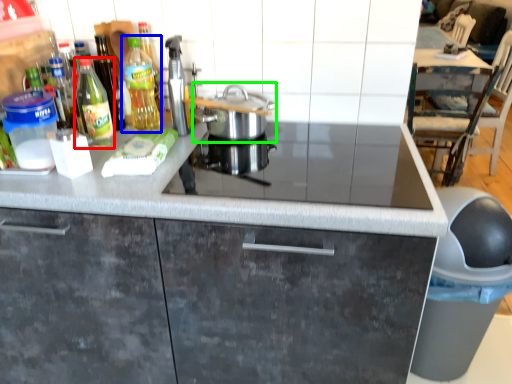
Question: Which object is positioned farthest from kitchen appliance (highlighted by a red box)? Select from kitchen appliance (highlighted by a blue box) and kitchen appliance (highlighted by a green box).

Choices:
 (A) kitchen appliance
 (B) kitchen appliance

Answer: (B)